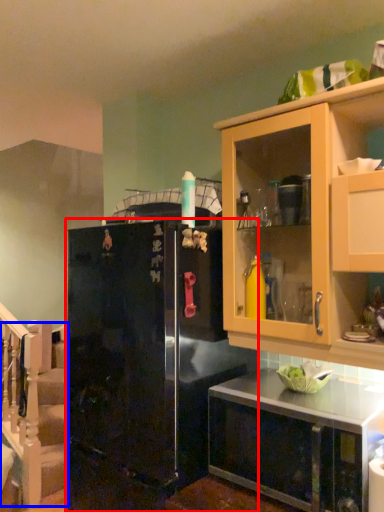
Question: Which object is closer to the camera taking this photo, refrigerator (highlighted by a red box) or stairwell (highlighted by a blue box)?

Choices:
 (A) refrigerator
 (B) stairwell

Answer: (A)